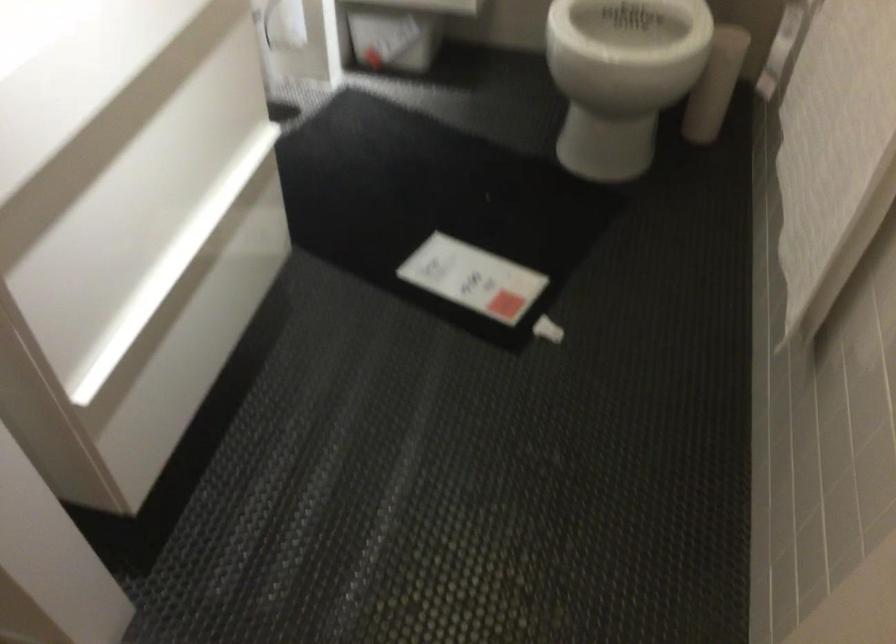
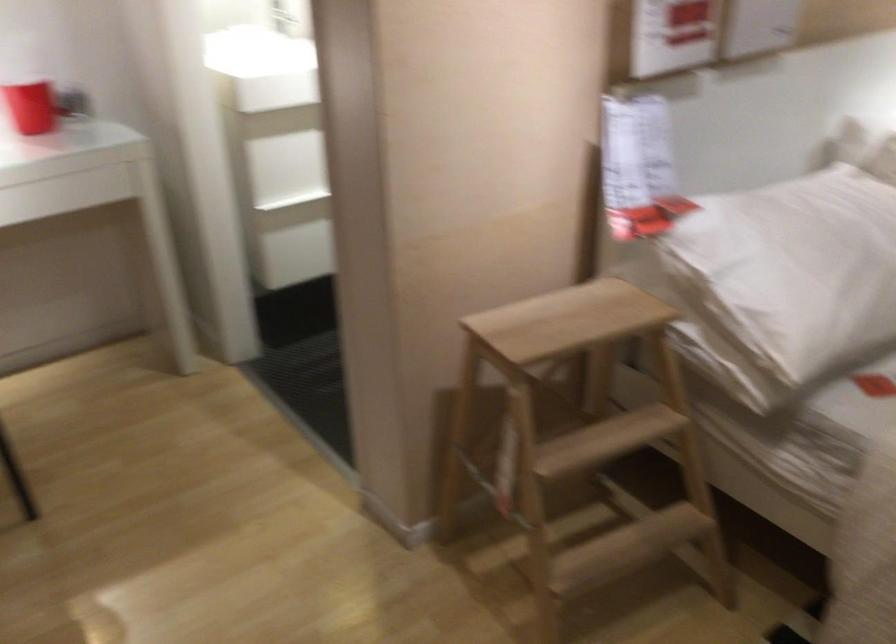
Question: I am providing you with two images of the same scene from different viewpoints. After the viewpoint changes to image2, which objects are now occluded?

Choices:
 (A) black floor mat
 (B) plaid window curtain
 (C) wooden step stool
 (D) white pillow

Answer: (A)